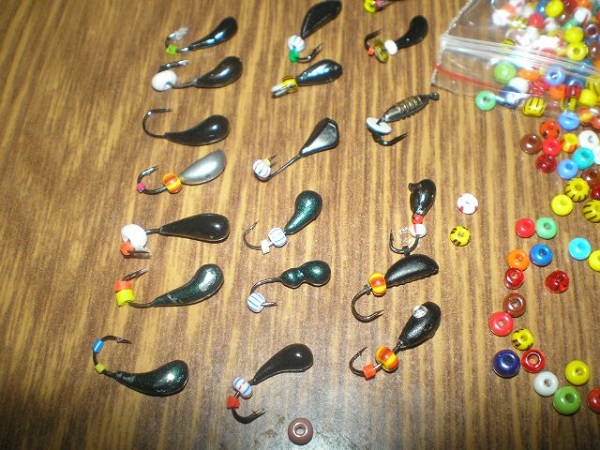
At what (x,y) coordinates should I click in order to perform the action: click on dark brown hardwood surface. Please return your answer as a coordinate pair (x, y). Image resolution: width=600 pixels, height=450 pixels. Looking at the image, I should click on (64, 102), (370, 207).